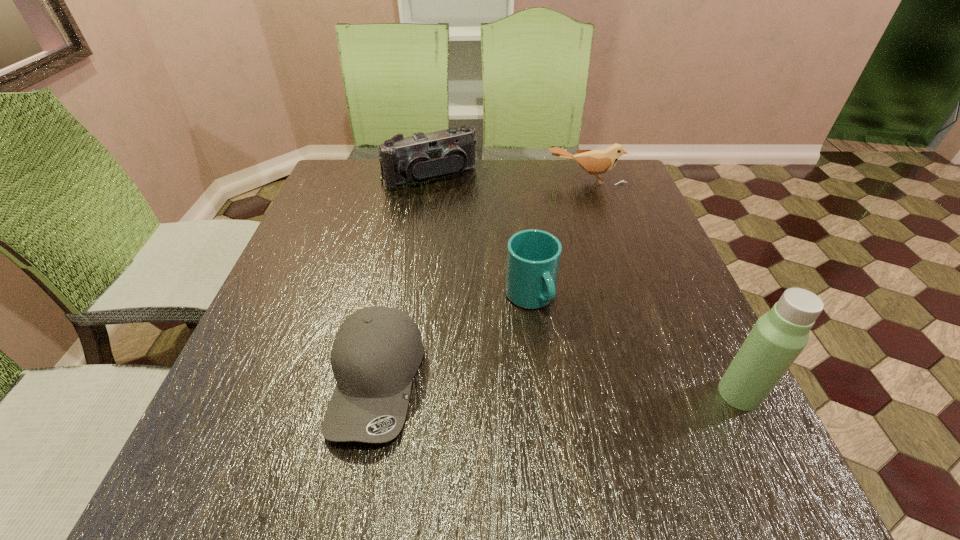
I want to click on blank space at the far left corner of the desktop, so click(x=348, y=165).

Identify the location of free spot between the thermos bottle and the baseball cap. (558, 387).

Image resolution: width=960 pixels, height=540 pixels. I want to click on vacant space that's between the third nearest object and the camcorder, so click(480, 238).

I want to click on free spot between the thermos bottle and the baseball cap, so click(558, 387).

The width and height of the screenshot is (960, 540). What are the coordinates of `blank region between the tallest object and the bird` in the screenshot? It's located at [x=662, y=287].

The width and height of the screenshot is (960, 540). In order to click on vacant space that's between the thermos bottle and the camcorder in this screenshot , I will do `click(585, 285)`.

The image size is (960, 540). I want to click on vacant space that's between the baseball cap and the bird, so click(481, 280).

This screenshot has height=540, width=960. In order to click on free spot between the third object from right to left and the bird in this screenshot , I will do `click(558, 239)`.

Where is `empty space between the baseball cap and the tallest object`? empty space between the baseball cap and the tallest object is located at coordinates (558, 387).

The width and height of the screenshot is (960, 540). Identify the location of free spot between the tallest object and the bird. (662, 287).